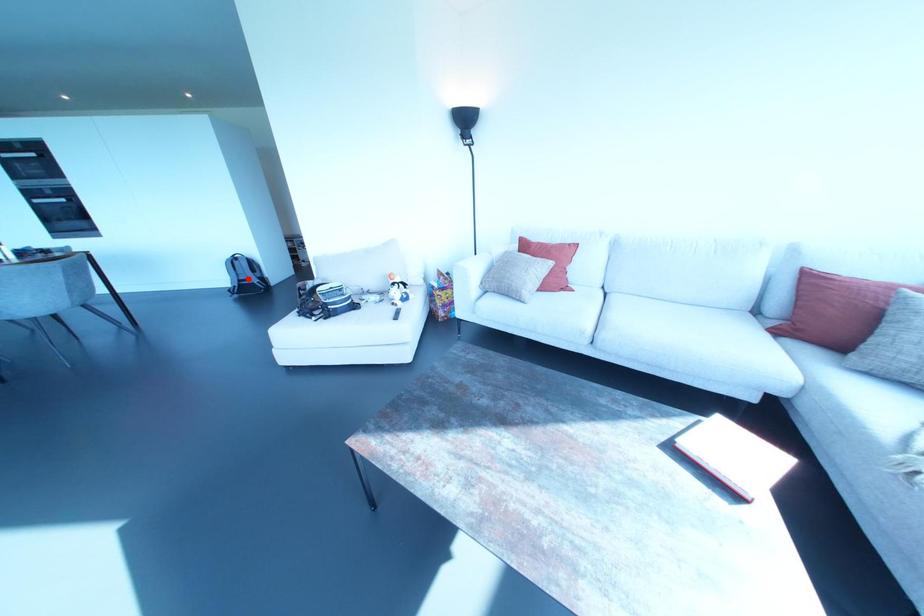
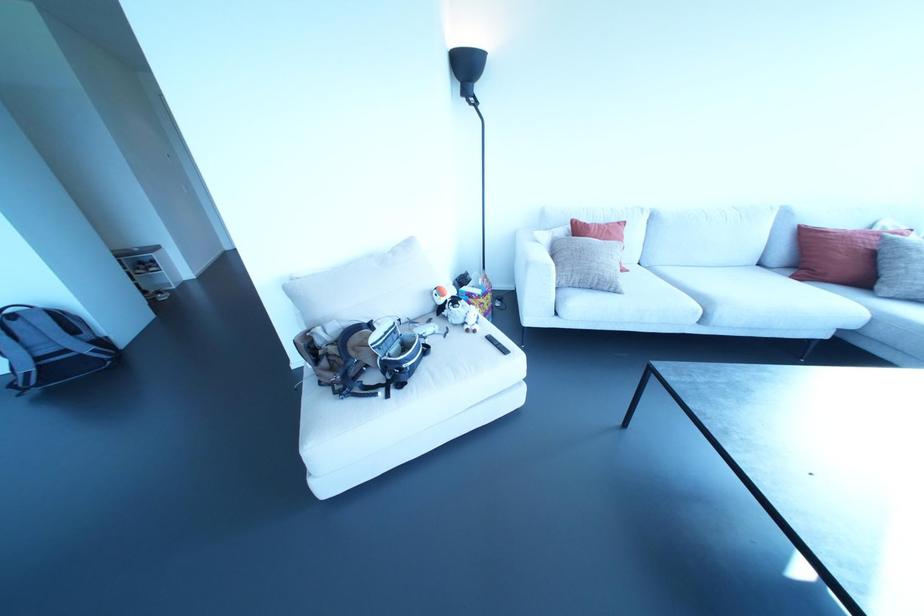
Question: I am providing you with two images of the same scene from different viewpoints. Image1 has a red point marked. In image2, the corresponding 3D location appears at what relative position? Reply with the corresponding letter.

Choices:
 (A) Closer
 (B) Farther

Answer: (B)